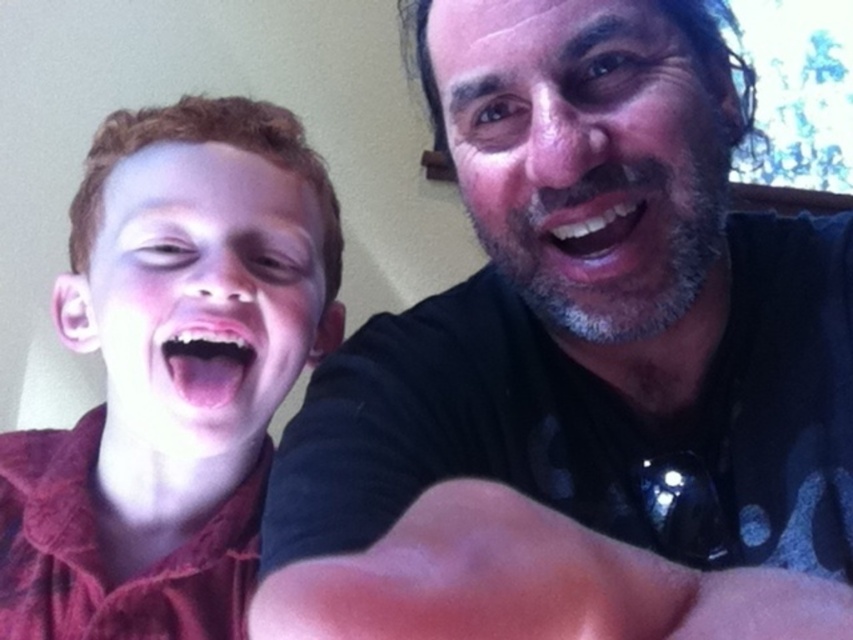
You are a photographer adjusting the focus of your camera. You need to ensure that both the gray beard at upper right and the pink flesh muscle at lower center are in focus. Which object should you focus on first to achieve this?

You should focus on the gray beard at upper right first because it is closer to the viewer than the pink flesh muscle at lower center. By focusing on the closer object, the depth of field may extend to include the farther object in acceptable focus.

You are a photographer trying to edit this image. You want to place a decorative sticker exactly at the location of the gray beard at upper right. What are the coordinates where you should place the sticker?

The gray beard at upper right is located at coordinates (587, 148), so you should place the sticker there.

You are a photographer who needs to adjust the lighting to avoid glare on the matte red shirt at left and the pink flesh muscle at lower center. Which object should you adjust the light closer to the camera first?

The matte red shirt at left is closer to the camera than the pink flesh muscle at lower center, so adjust the light closer to the matte red shirt at left first to reduce glare.